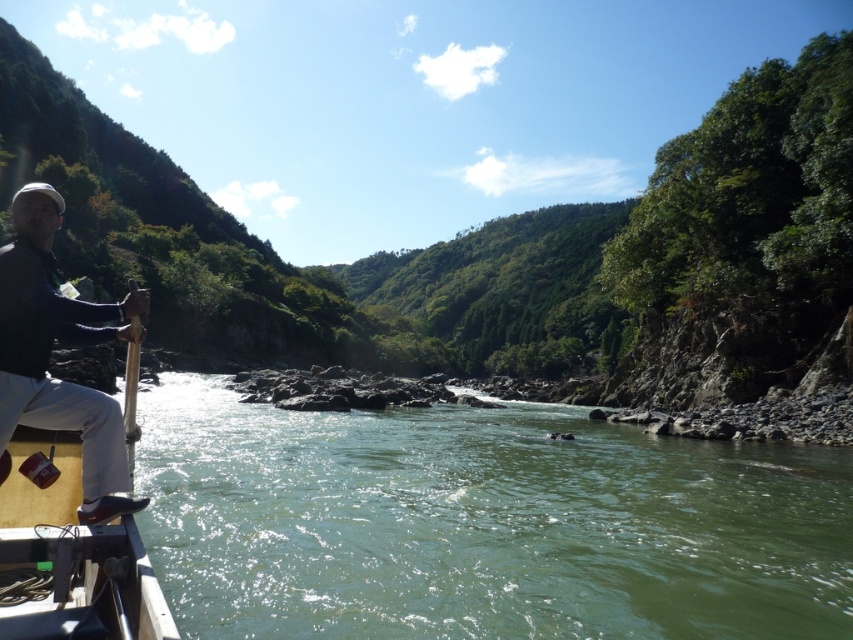
Is green smooth water at center to the left of matte black jacket at left from the viewer's perspective?

No, green smooth water at center is not to the left of matte black jacket at left.

Can you confirm if green smooth water at center is positioned to the right of matte black jacket at left?

Yes, green smooth water at center is to the right of matte black jacket at left.

Does point (296, 570) come closer to viewer compared to point (1, 272)?

No, it is behind (1, 272).

Find the location of a particular element. This screenshot has width=853, height=640. green smooth water at center is located at coordinates [x=482, y=524].